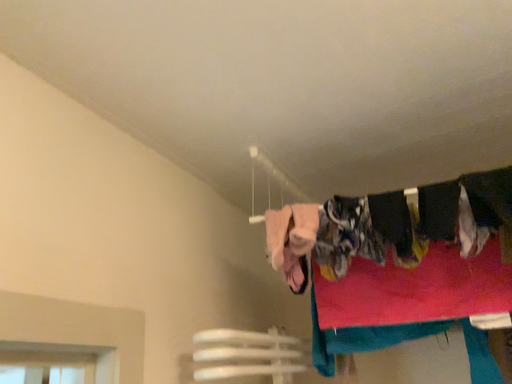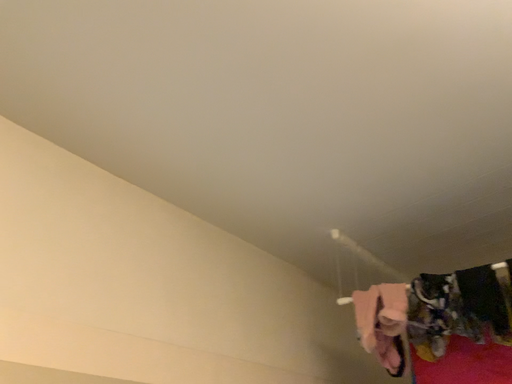
Question: Which way did the camera rotate in the video?

Choices:
 (A) rotated left
 (B) rotated right

Answer: (A)